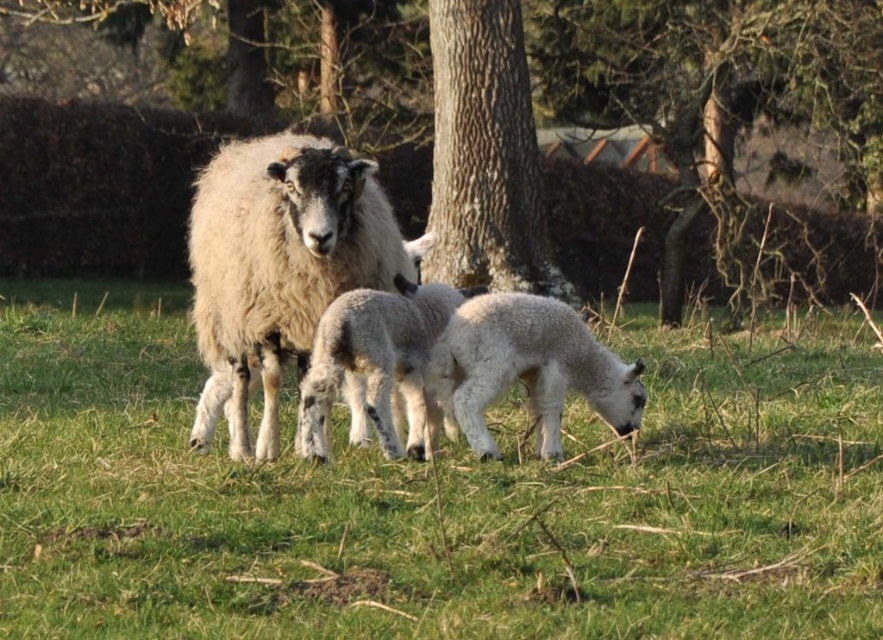
Question: Does smooth bark tree at center appear under white woolen lamb at center?

Choices:
 (A) yes
 (B) no

Answer: (B)

Question: Which of the following is the closest to the observer?

Choices:
 (A) (281, 477)
 (B) (602, 4)

Answer: (A)

Question: Estimate the real-world distances between objects in this image. Which object is farther from the rough bark tree at center?

Choices:
 (A) white woolen sheep at center
 (B) fuzzy white sheep at center
 (C) white woolen lamb at center

Answer: (A)

Question: Can you confirm if white woolen sheep at center is bigger than rough bark tree at center?

Choices:
 (A) no
 (B) yes

Answer: (A)

Question: Does white woolen sheep at center have a greater width compared to smooth bark tree at center?

Choices:
 (A) yes
 (B) no

Answer: (A)

Question: Which point is farther to the camera?

Choices:
 (A) white woolen lamb at center
 (B) smooth bark tree at center

Answer: (B)